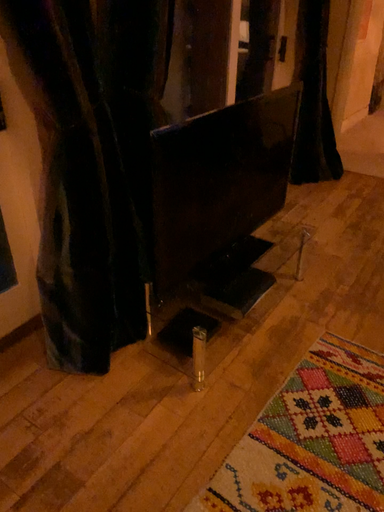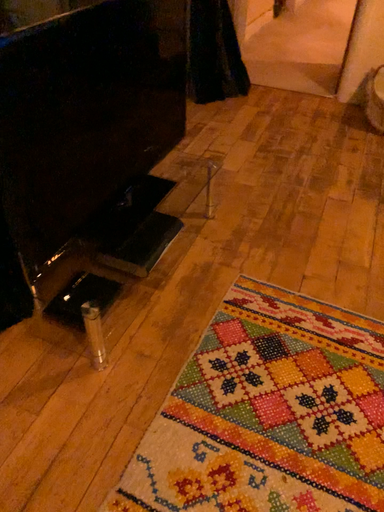
Question: How did the camera likely rotate when shooting the video?

Choices:
 (A) rotated left
 (B) rotated right

Answer: (B)